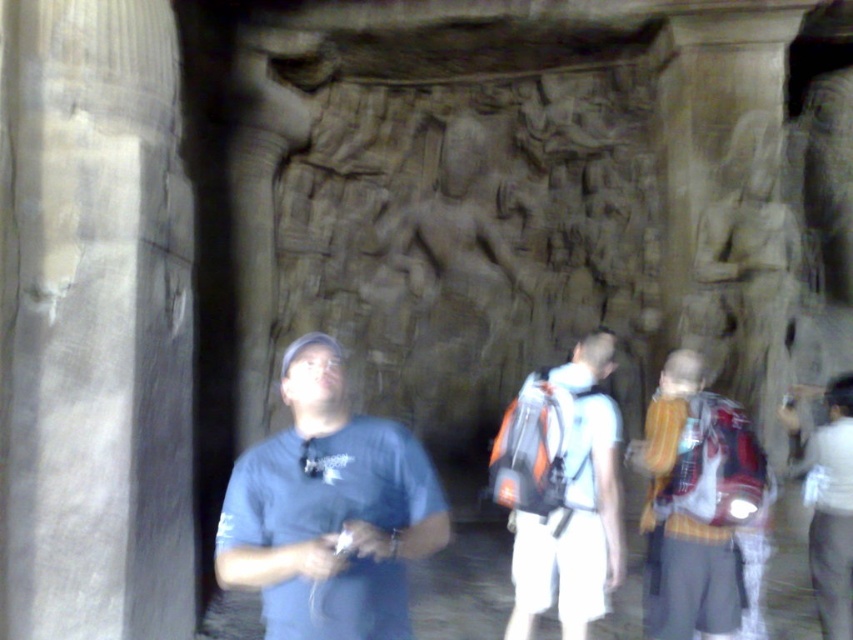
Question: Which of the following is the farthest from the observer?

Choices:
 (A) blue fabric shirt at center
 (B) white marble pillar at left
 (C) white cotton shirt at center
 (D) white matte backpack at center

Answer: (C)

Question: Is white marble pillar at left thinner than blue fabric shirt at center?

Choices:
 (A) no
 (B) yes

Answer: (B)

Question: Which is farther from the white cotton shirt at center?

Choices:
 (A) white matte backpack at center
 (B) blue fabric shirt at center
 (C) yellow striped shirt at center

Answer: (B)

Question: Does white marble pillar at left have a larger size compared to blue fabric shirt at center?

Choices:
 (A) no
 (B) yes

Answer: (B)

Question: Is white marble pillar at left positioned before white cotton shirt at center?

Choices:
 (A) no
 (B) yes

Answer: (B)

Question: Which object is positioned farthest from the white matte backpack at center?

Choices:
 (A) white cotton shirt at center
 (B) white marble pillar at left
 (C) blue fabric shirt at center
 (D) yellow striped shirt at center

Answer: (B)